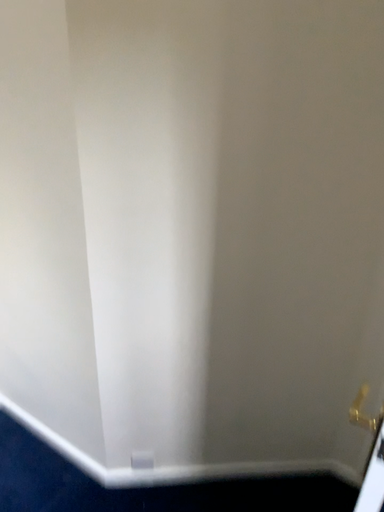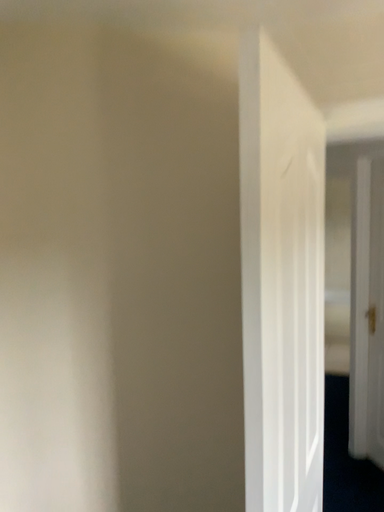
Question: Which way did the camera rotate in the video?

Choices:
 (A) rotated upward
 (B) rotated downward

Answer: (A)